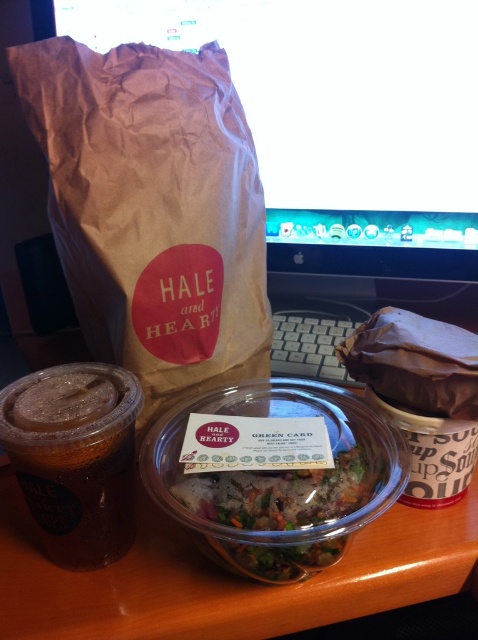
Is brown paper bag at upper left bigger than clear plastic container at center?

No, brown paper bag at upper left is not bigger than clear plastic container at center.

Consider the image. Who is lower down, brown paper bag at upper left or clear plastic container at center?

Positioned lower is clear plastic container at center.

Measure the distance between point (88,205) and camera.

They are 16.69 inches apart.

Where is `brown paper bag at upper left`? brown paper bag at upper left is located at coordinates (152, 209).

Looking at this image, between brown paper bag at upper left and translucent plastic cup at left, which one appears on the left side from the viewer's perspective?

translucent plastic cup at left is more to the left.

Between brown paper bag at upper left and translucent plastic cup at left, which one appears on the right side from the viewer's perspective?

brown paper bag at upper left is more to the right.

Is point (61, 106) positioned behind point (64, 536)?

Yes, point (61, 106) is behind point (64, 536).

Locate an element on the screen. brown paper bag at upper left is located at coordinates (152, 209).

You are a GUI agent. You are given a task and a screenshot of the screen. Output one action in this format:
    pyautogui.click(x=<x>, y=<y>)
    Task: Click on the clear plastic container at center
    The height and width of the screenshot is (640, 478).
    Given the screenshot: What is the action you would take?
    pyautogui.click(x=224, y=579)

Is clear plastic container at center smaller than translucent plastic cup at left?

No, clear plastic container at center is not smaller than translucent plastic cup at left.

Between point (360, 557) and point (108, 492), which one is positioned in front?

Point (108, 492)

The height and width of the screenshot is (640, 478). Find the location of `clear plastic container at center`. clear plastic container at center is located at coordinates (224, 579).